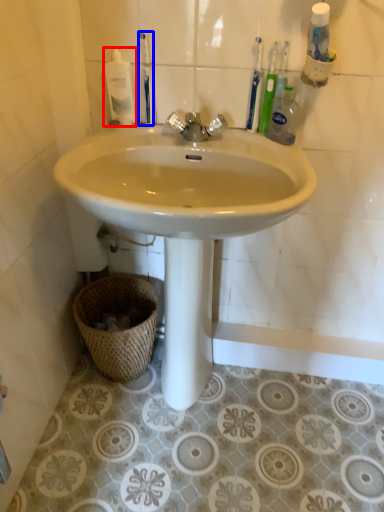
Question: Which object is further to the camera taking this photo, mouthwash (highlighted by a red box) or toothbrush (highlighted by a blue box)?

Choices:
 (A) mouthwash
 (B) toothbrush

Answer: (A)